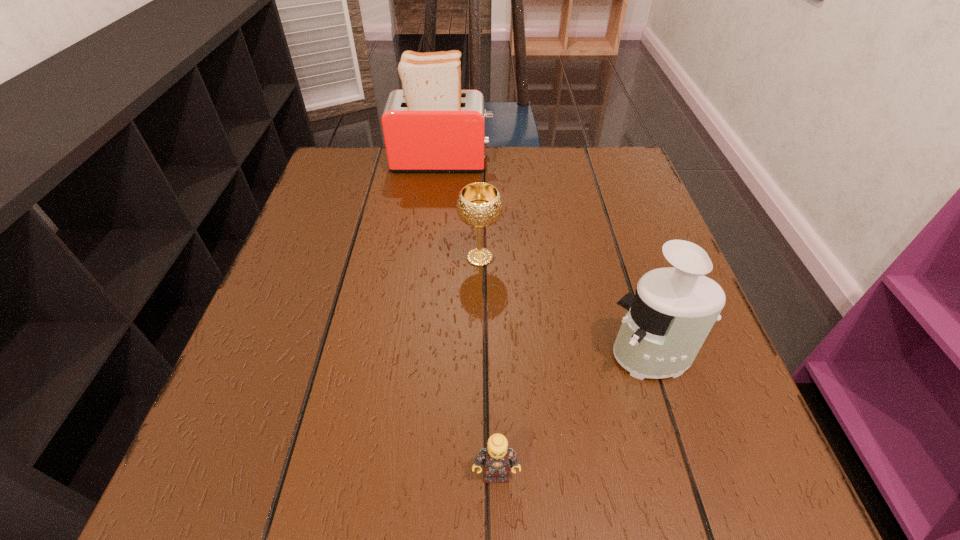
Identify the location of unoccupied position between the juicer and the chalice. Image resolution: width=960 pixels, height=540 pixels. click(x=565, y=307).

The height and width of the screenshot is (540, 960). In order to click on vacant point located between the rightmost object and the farthest object in this screenshot , I will do `click(547, 259)`.

This screenshot has width=960, height=540. In order to click on free space that is in between the juicer and the second shortest object in this screenshot , I will do `click(565, 307)`.

This screenshot has width=960, height=540. I want to click on free space between the farthest object and the nearest object, so click(469, 318).

Locate an element on the screen. This screenshot has height=540, width=960. free space between the toaster and the nearest object is located at coordinates (469, 318).

I want to click on empty space that is in between the chalice and the third farthest object, so click(565, 307).

This screenshot has height=540, width=960. I want to click on free space between the nearest object and the farthest object, so click(x=469, y=318).

Identify the location of object that is the nearest to the second shortest object. The height and width of the screenshot is (540, 960). (667, 321).

Find the location of a particular element. The height and width of the screenshot is (540, 960). object that is the second closest one to the second nearest object is located at coordinates (479, 205).

This screenshot has width=960, height=540. Identify the location of free spot that satisfies the following two spatial constraints: 1. on the front-facing side of the second nearest object; 2. on the left side of the farthest object. (420, 356).